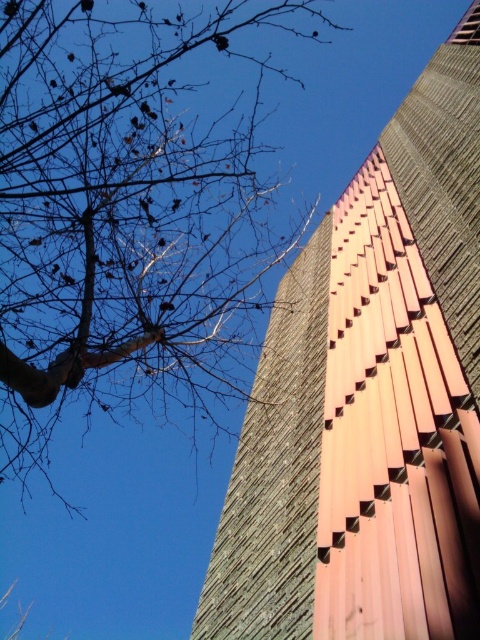
You are an architect analyzing the composition of this image. You notice the rustic wood paneling at upper right and the bare branches at upper left. Which element is visually layered above the other in the scene?

The rustic wood paneling at upper right is positioned over the bare branches at upper left, making it appear layered above them in the visual composition.

You are an architect designing a new building and want to ensure that the rustic wood paneling at upper right and the bare branches at upper left in the image are spaced appropriately. Given that the minimum required distance between such elements for safety is 20 meters, does the current spacing meet the requirement?

The rustic wood paneling at upper right and the bare branches at upper left are 22.87 meters apart, which exceeds the minimum required distance of 20 meters for safety. Therefore, the current spacing meets the requirement.

You are an architect analyzing the composition of this image. You need to determine which element is positioned closer to the foreground. Based on the scene, which is closer to the viewer between the rustic wood paneling at upper right and the bare branches at upper left?

The rustic wood paneling at upper right is closer to the viewer than the bare branches at upper left.